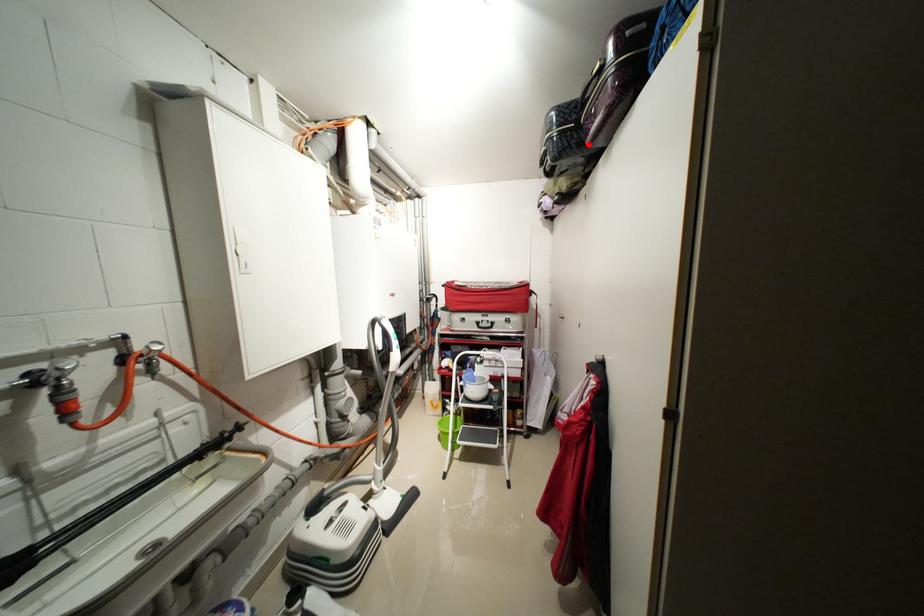
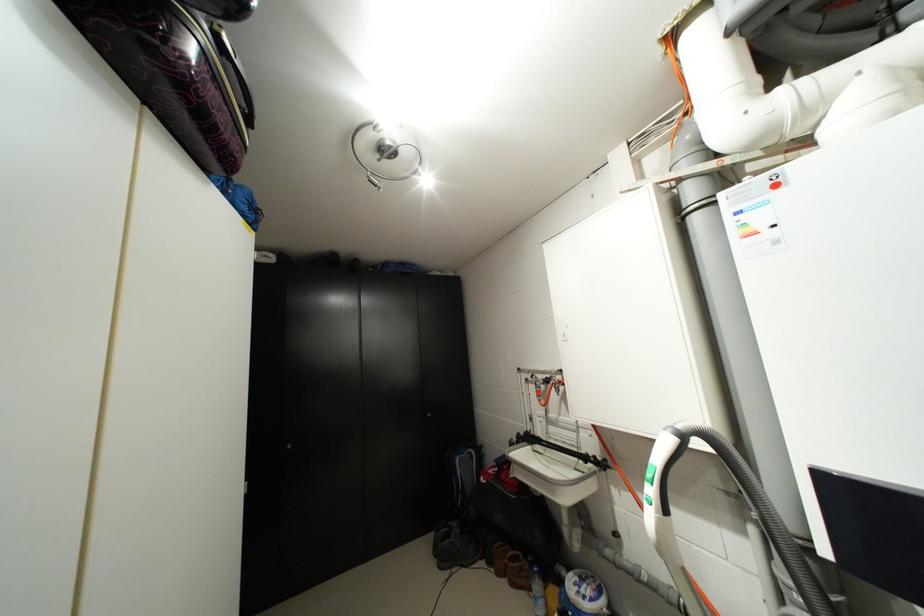
Question: I am providing you with two images of the same scene from different viewpoints. A red point is marked on the first image. Can you still see the location of the red point in image 2?

Choices:
 (A) Yes
 (B) No

Answer: (A)